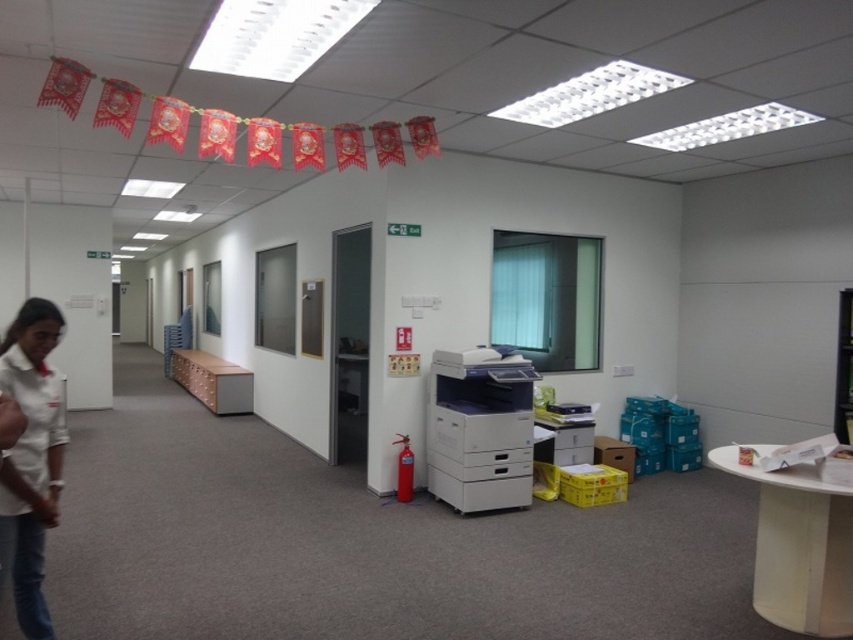
You are standing in the office scene described. You notice a point marked at coordinates (32,460). What object is located at that point?

The point at coordinates (32,460) indicates the white fabric shirt at left.

In the scene shown: You are standing at the entrance of the office and want to locate the white plastic printer at center. According to the coordinates provided, in which direction should you move from the entrance to reach it?

The white plastic printer at center is located at coordinates point (480, 429). Since the entrance is typically located at the lower left corner of an office, moving towards the center would mean moving towards the right and upwards slightly to reach the printer.